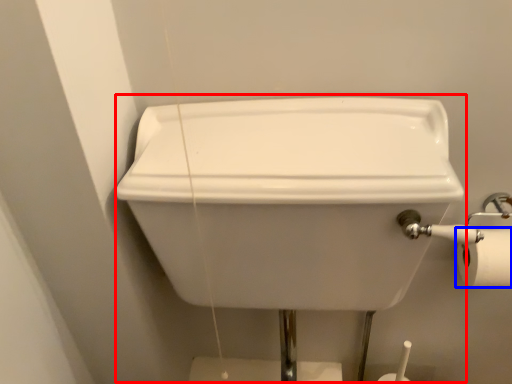
Question: Which point is closer to the camera, sink (highlighted by a red box) or toilet paper (highlighted by a blue box)?

Choices:
 (A) sink
 (B) toilet paper

Answer: (A)